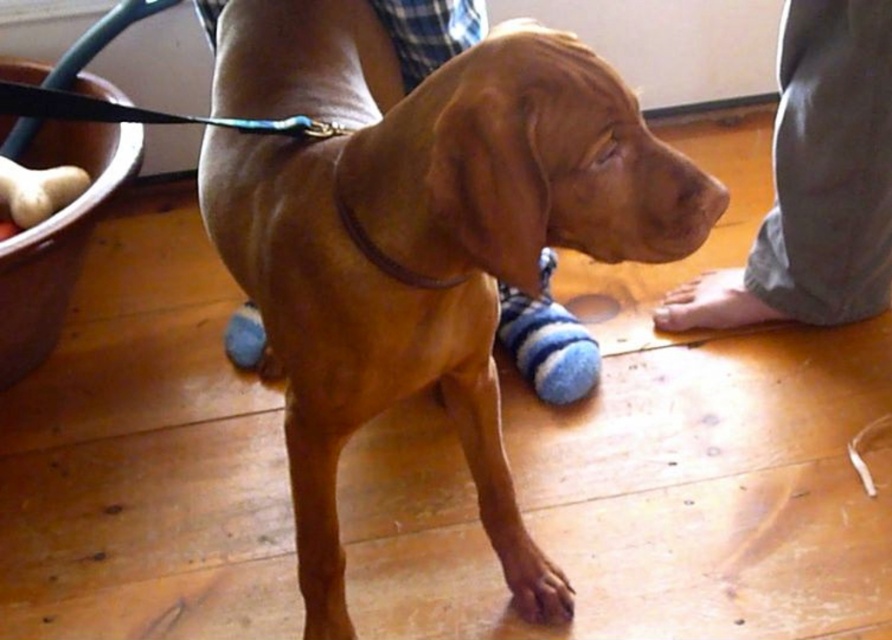
Does point (216, 104) come closer to viewer compared to point (715, 218)?

That is False.

Between point (356, 364) and point (709, 192), which one is positioned behind?

Positioned behind is point (356, 364).

Find the location of `brown leather dog at center`. brown leather dog at center is located at coordinates (415, 227).

Who is more distant from viewer, (515, 552) or (705, 211)?

Positioned behind is point (515, 552).

Does point (509, 579) come in front of point (709, 209)?

No, (509, 579) is further to viewer.

You are a GUI agent. You are given a task and a screenshot of the screen. Output one action in this format:
    pyautogui.click(x=<x>, y=<y>)
    Task: Click on the brown fur paw at lower center
    This screenshot has height=640, width=892.
    Given the screenshot: What is the action you would take?
    pos(531,576)

You are a GUI agent. You are given a task and a screenshot of the screen. Output one action in this format:
    pyautogui.click(x=<x>, y=<y>)
    Task: Click on the brown fur paw at lower center
    
    Given the screenshot: What is the action you would take?
    pyautogui.click(x=531, y=576)

Does brown leather dog at center appear on the right side of gray cotton pants at lower right?

Incorrect, brown leather dog at center is not on the right side of gray cotton pants at lower right.

Does brown leather dog at center have a lesser width compared to gray cotton pants at lower right?

No, brown leather dog at center is not thinner than gray cotton pants at lower right.

This screenshot has width=892, height=640. Find the location of `brown leather dog at center`. brown leather dog at center is located at coordinates pos(415,227).